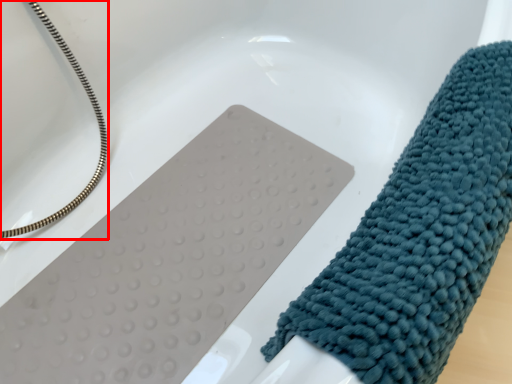
Question: Observing the image, what is the correct spatial positioning of rope (annotated by the red box) in reference to towel?

Choices:
 (A) right
 (B) left

Answer: (B)